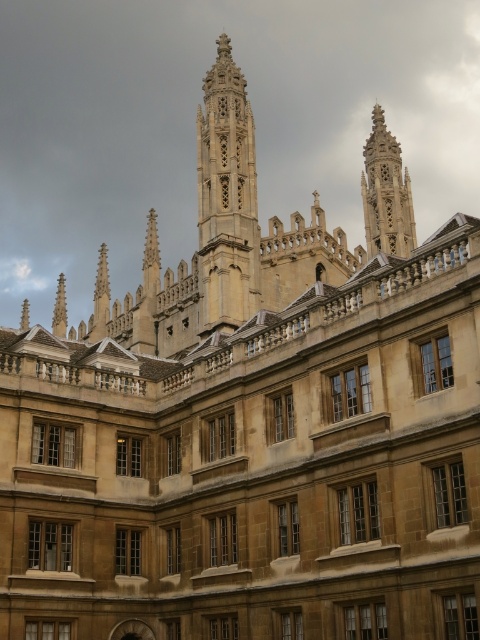
Is golden stone tower at center above golden stone spire at upper center?

Correct, golden stone tower at center is located above golden stone spire at upper center.

Does golden stone tower at center have a smaller size compared to golden stone spire at upper center?

No.

Where is `golden stone tower at center`? This screenshot has height=640, width=480. golden stone tower at center is located at coordinates (227, 196).

This screenshot has width=480, height=640. I want to click on golden stone tower at center, so click(227, 196).